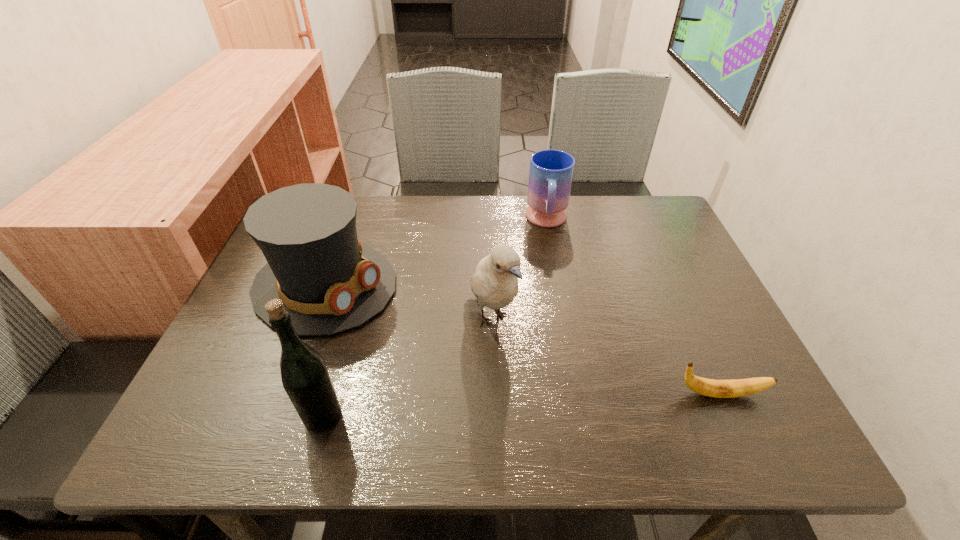
This screenshot has width=960, height=540. Identify the location of object at the left edge. (330, 283).

You are a GUI agent. You are given a task and a screenshot of the screen. Output one action in this format:
    pyautogui.click(x=<x>, y=<y>)
    Task: Click on the object that is at the right edge
    This screenshot has height=540, width=960.
    Given the screenshot: What is the action you would take?
    pyautogui.click(x=708, y=387)

Find the location of `object present at the far left corner`. object present at the far left corner is located at coordinates (330, 283).

At what (x,y) coordinates should I click in order to perform the action: click on object at the near right corner. Please return your answer as a coordinate pair (x, y). This screenshot has width=960, height=540. Looking at the image, I should click on (708, 387).

You are a GUI agent. You are given a task and a screenshot of the screen. Output one action in this format:
    pyautogui.click(x=<x>, y=<y>)
    Task: Click on the vacant point at the far edge
    
    Given the screenshot: What is the action you would take?
    pyautogui.click(x=576, y=225)

In the image, there is a desktop. Identify the location of blank space at the near edge. (396, 379).

This screenshot has width=960, height=540. I want to click on free spot at the left edge of the desktop, so click(x=227, y=357).

In order to click on vacant space at the right edge of the desktop in this screenshot , I will do click(x=703, y=291).

Identify the location of free region at the near left corner. This screenshot has height=540, width=960. (215, 406).

In the image, there is a desktop. Where is `vacant space at the far right corner`? vacant space at the far right corner is located at coordinates (658, 214).